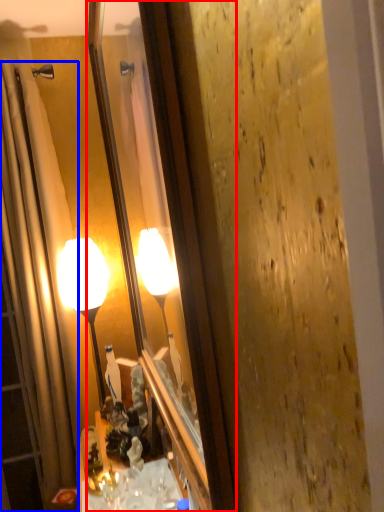
Question: Among these objects, which one is nearest to the camera, mirror (highlighted by a red box) or shower curtain (highlighted by a blue box)?

Choices:
 (A) mirror
 (B) shower curtain

Answer: (A)